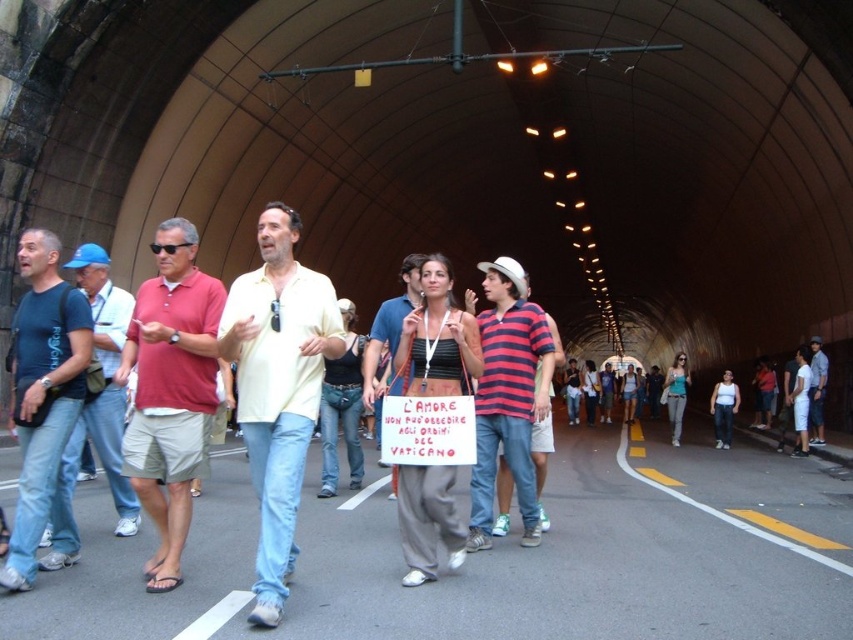
Is point (51, 296) farther from camera compared to point (393, 324)?

No, (51, 296) is closer to viewer.

Does matte blue t-shirt at left have a lesser width compared to matte yellow shirt at center?

Correct, matte blue t-shirt at left's width is less than matte yellow shirt at center's.

Locate an element on the screen. matte blue t-shirt at left is located at coordinates (44, 401).

Is the position of blue denim jeans at left more distant than that of matte yellow shirt at center?

No, it is not.

Is blue denim jeans at left below matte yellow shirt at center?

No, blue denim jeans at left is not below matte yellow shirt at center.

Locate an element on the screen. Image resolution: width=853 pixels, height=640 pixels. blue denim jeans at left is located at coordinates (103, 385).

Does blue denim jeans at left appear under denim shorts at center?

Actually, blue denim jeans at left is above denim shorts at center.

Who is more distant from viewer, (96, 324) or (813, 360)?

Positioned behind is point (813, 360).

The image size is (853, 640). I want to click on blue denim jeans at left, so click(x=103, y=385).